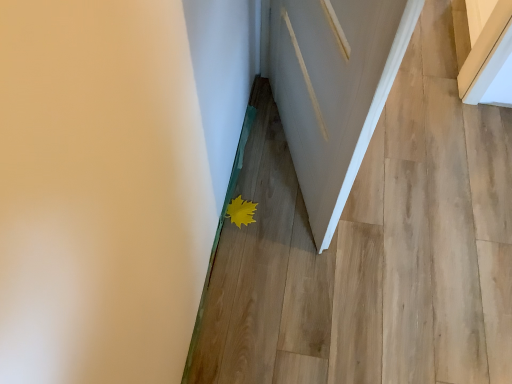
Where is `vacant space to the right of yellow matte leaf at lower center`? vacant space to the right of yellow matte leaf at lower center is located at coordinates (283, 216).